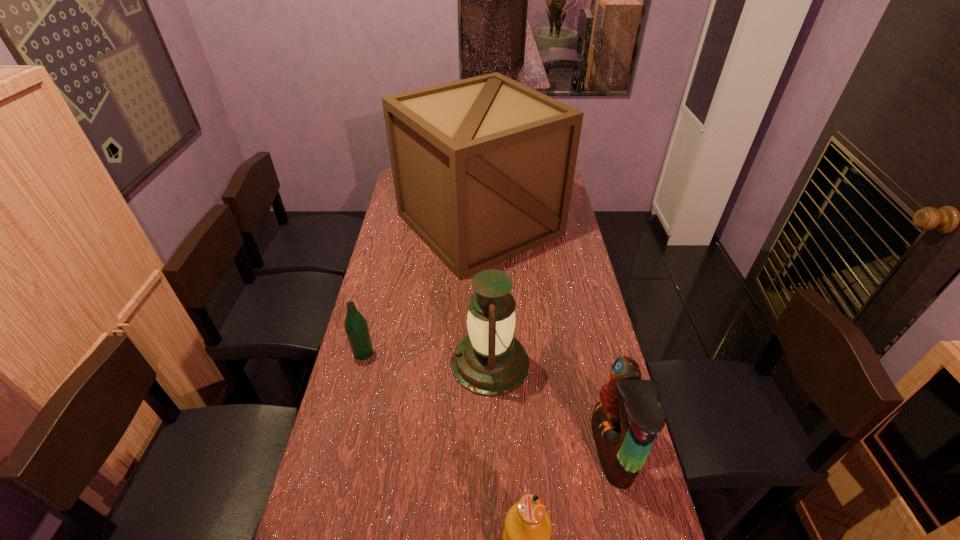
Identify the location of vacant space at the left edge of the desktop. This screenshot has height=540, width=960. (407, 277).

Locate an element on the screen. free space at the right edge of the desktop is located at coordinates (566, 258).

Find the location of `free space between the shortest object and the fourth farthest object`. free space between the shortest object and the fourth farthest object is located at coordinates (488, 401).

Locate an element on the screen. The height and width of the screenshot is (540, 960). free area in between the bottle and the lantern is located at coordinates (427, 358).

Locate an element on the screen. The width and height of the screenshot is (960, 540). free spot between the parrot and the shortest object is located at coordinates (488, 401).

Where is `free spot between the farthest object and the fourth farthest object`? The width and height of the screenshot is (960, 540). free spot between the farthest object and the fourth farthest object is located at coordinates (546, 337).

I want to click on the second closest object to the box, so click(x=356, y=327).

Identify which object is the fourth closest to the lantern. Please provide its 2D coordinates. Your answer should be formatted as a tuple, i.e. [(x, y)], where the tuple contains the x and y coordinates of a point satisfying the conditions above.

[(527, 531)]